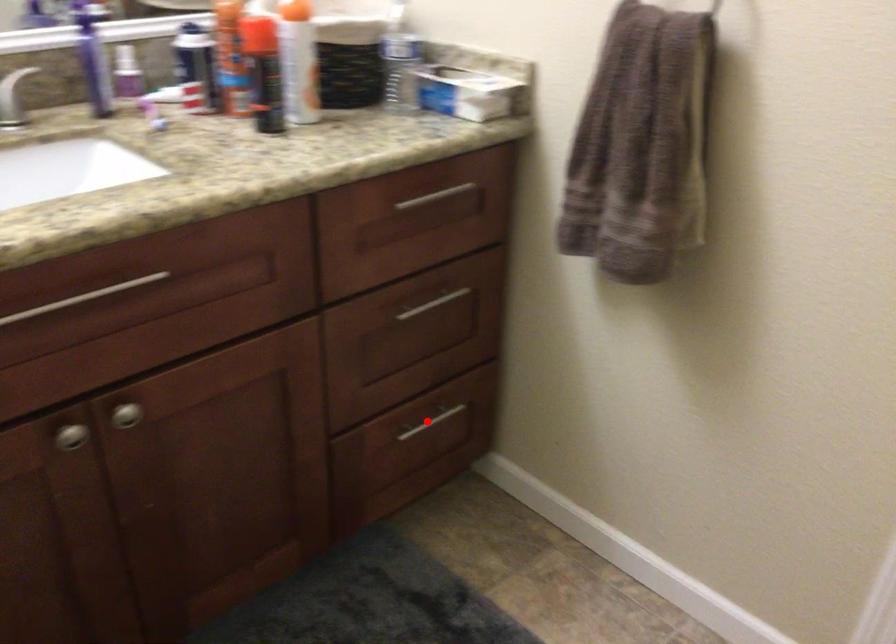
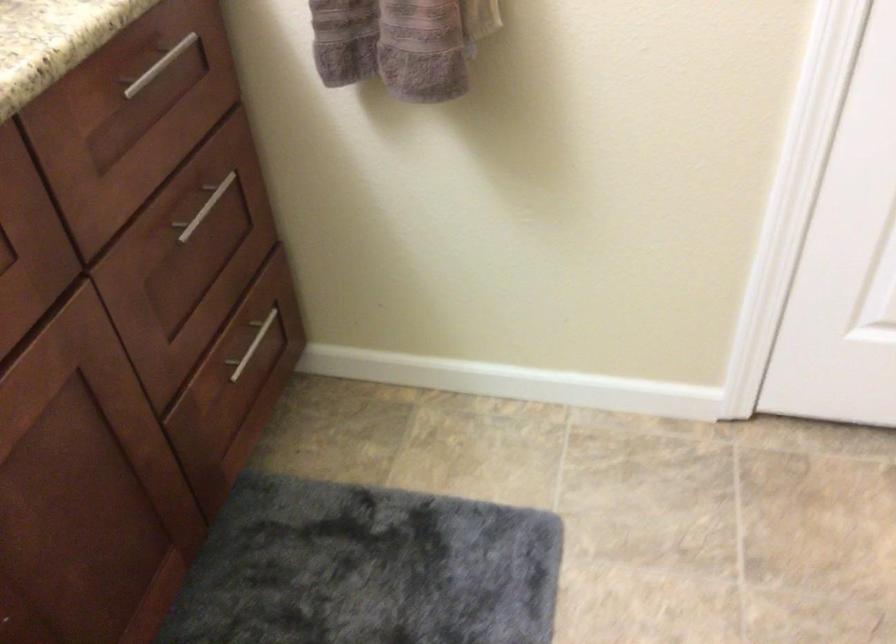
The point at the highlighted location is marked in the first image. Where is the corresponding point in the second image?

(252, 345)